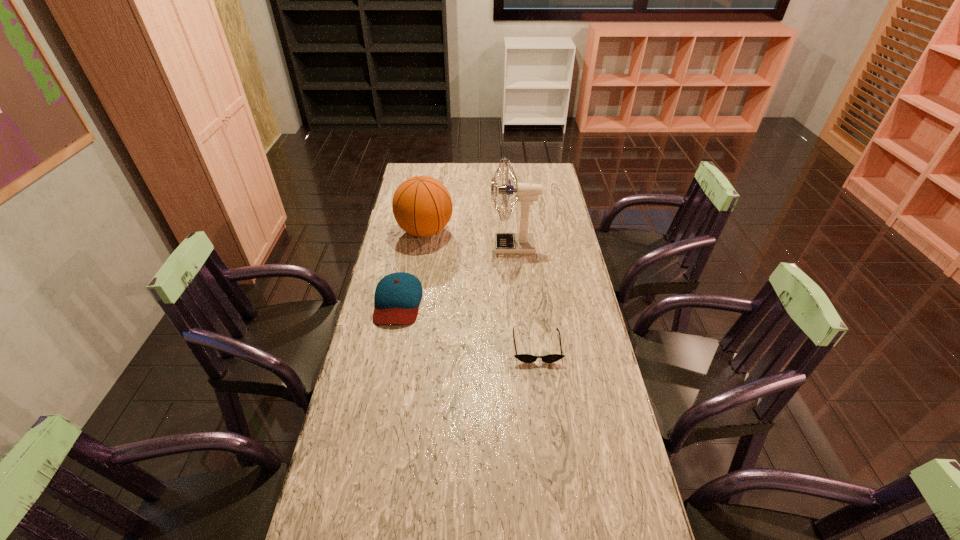
At what (x,y) coordinates should I click in order to perform the action: click on vacant region that satisfies the following two spatial constraints: 1. on the front-facing side of the fan; 2. with the bill of the third tallest object facing forward. Please return your answer as a coordinate pair (x, y). This screenshot has width=960, height=540. Looking at the image, I should click on (518, 301).